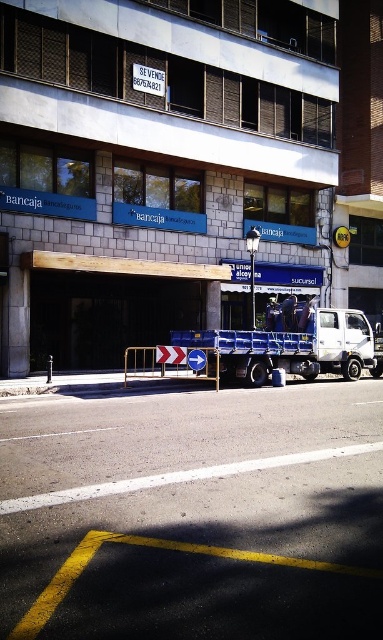
Question: Which object is farther from the camera taking this photo?

Choices:
 (A) metallic silver barricade at center
 (B) white matte truck at center

Answer: (B)

Question: Is white matte truck at center to the right of metallic silver barricade at center from the viewer's perspective?

Choices:
 (A) no
 (B) yes

Answer: (B)

Question: Is white matte truck at center positioned behind metallic silver barricade at center?

Choices:
 (A) yes
 (B) no

Answer: (A)

Question: Is white matte truck at center to the right of metallic silver barricade at center from the viewer's perspective?

Choices:
 (A) yes
 (B) no

Answer: (A)